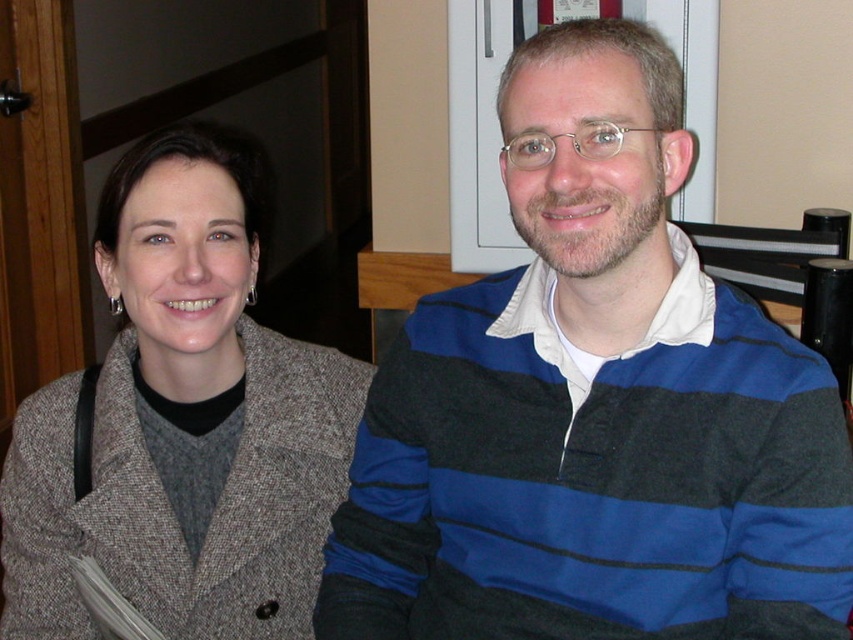
Question: Which point is closer to the camera?

Choices:
 (A) blue striped sweater at center
 (B) matte gray coat at center

Answer: (A)

Question: Is blue striped sweater at center below matte gray coat at center?

Choices:
 (A) no
 (B) yes

Answer: (A)

Question: From the image, what is the correct spatial relationship of blue striped sweater at center in relation to matte gray coat at center?

Choices:
 (A) above
 (B) below

Answer: (A)

Question: Can you confirm if blue striped sweater at center is bigger than matte gray coat at center?

Choices:
 (A) yes
 (B) no

Answer: (A)

Question: Which of the following is the farthest from the observer?

Choices:
 (A) (554, 33)
 (B) (105, 496)

Answer: (B)